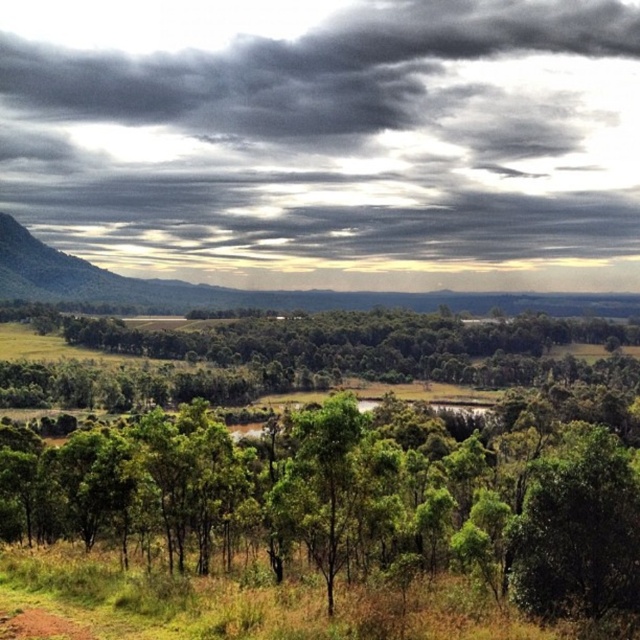
Does dark gray cloud at upper center have a lesser height compared to green leafy trees at center?

Incorrect, dark gray cloud at upper center's height does not fall short of green leafy trees at center's.

Which is in front, point (45, 116) or point (392, 483)?

Positioned in front is point (392, 483).

The image size is (640, 640). What do you see at coordinates (323, 132) in the screenshot? I see `dark gray cloud at upper center` at bounding box center [323, 132].

Locate an element on the screen. This screenshot has width=640, height=640. dark gray cloud at upper center is located at coordinates (323, 132).